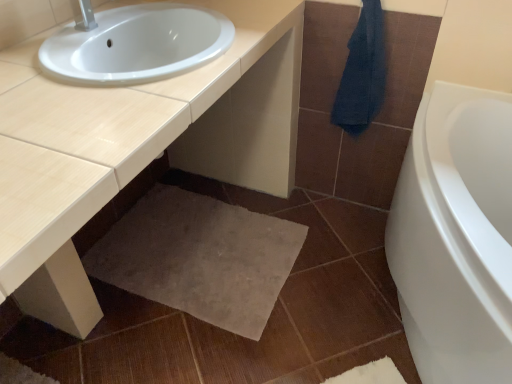
Find the location of a particular element. free space in front of beige carpet at lower center is located at coordinates 182,345.